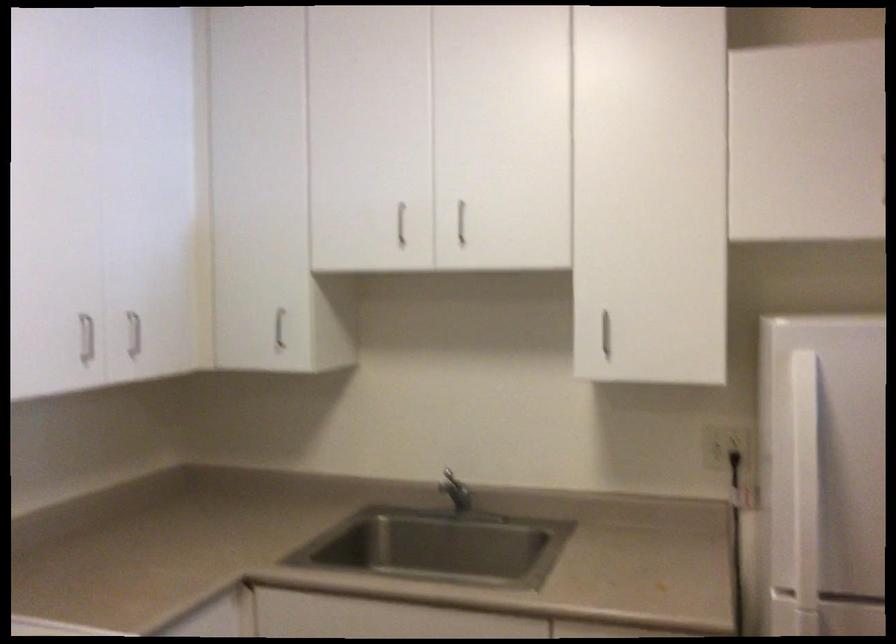
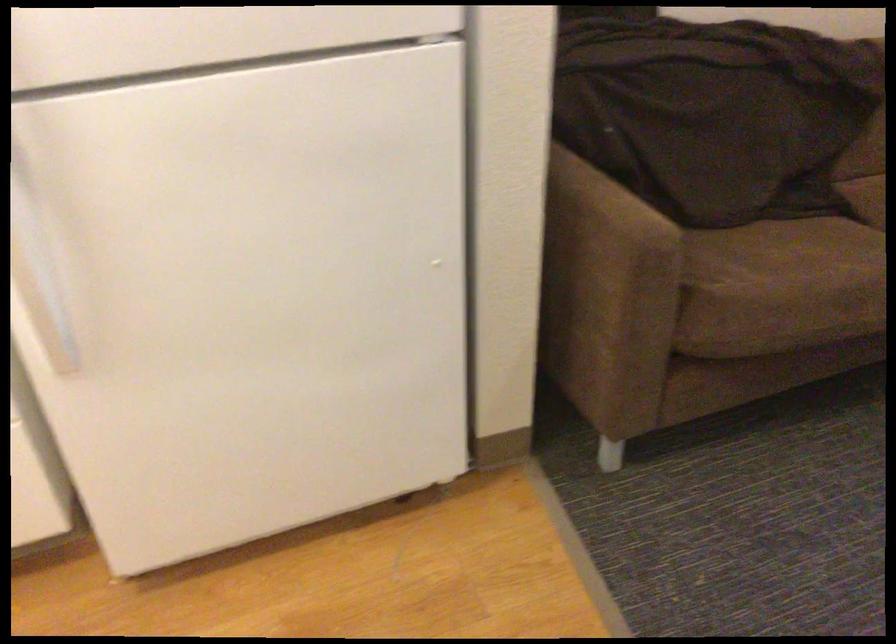
How did the camera likely rotate?

The rotation direction of the camera is right-down.